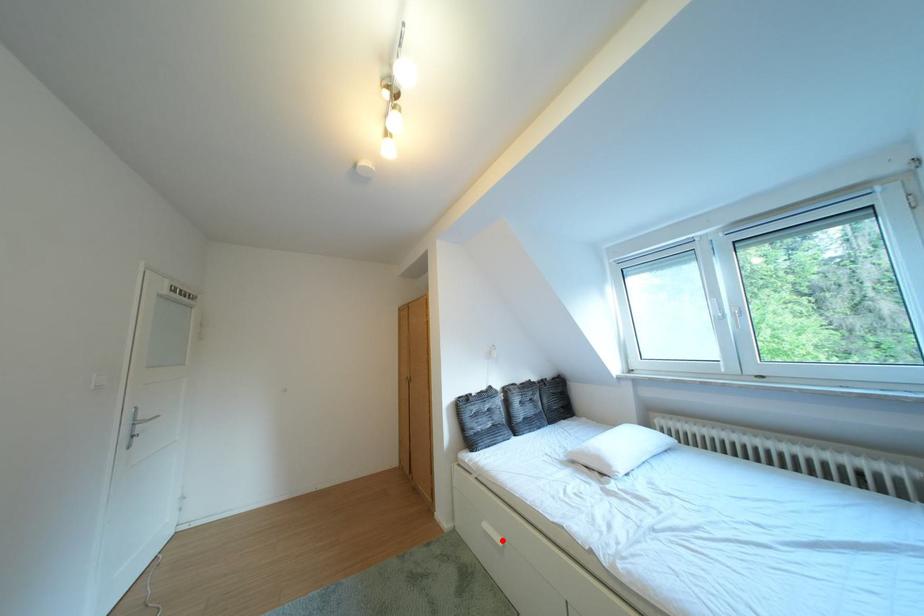
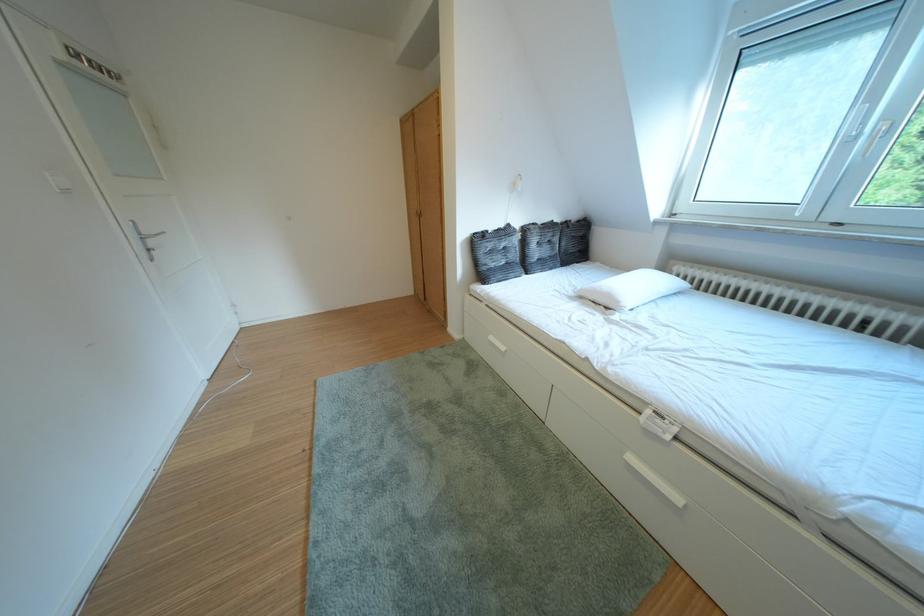
The point at the highlighted location is marked in the first image. Where is the corresponding point in the second image?

(506, 350)